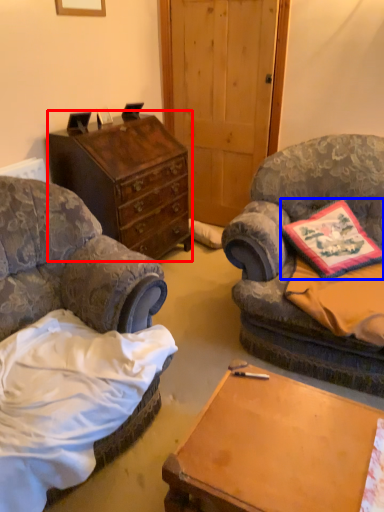
Question: Which of the following is the closest to the observer, chest of drawers (highlighted by a red box) or pillow (highlighted by a blue box)?

Choices:
 (A) chest of drawers
 (B) pillow

Answer: (B)